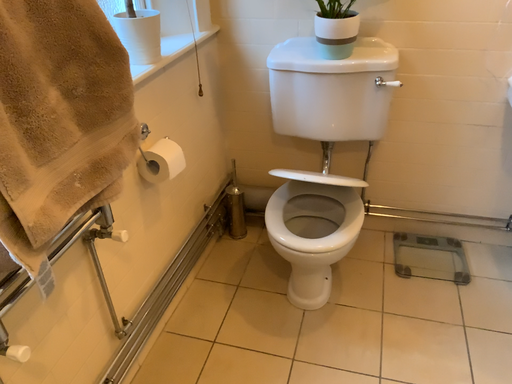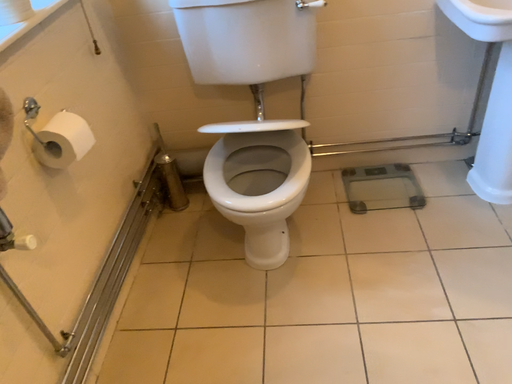
Question: How did the camera likely rotate when shooting the video?

Choices:
 (A) rotated left
 (B) rotated right

Answer: (B)